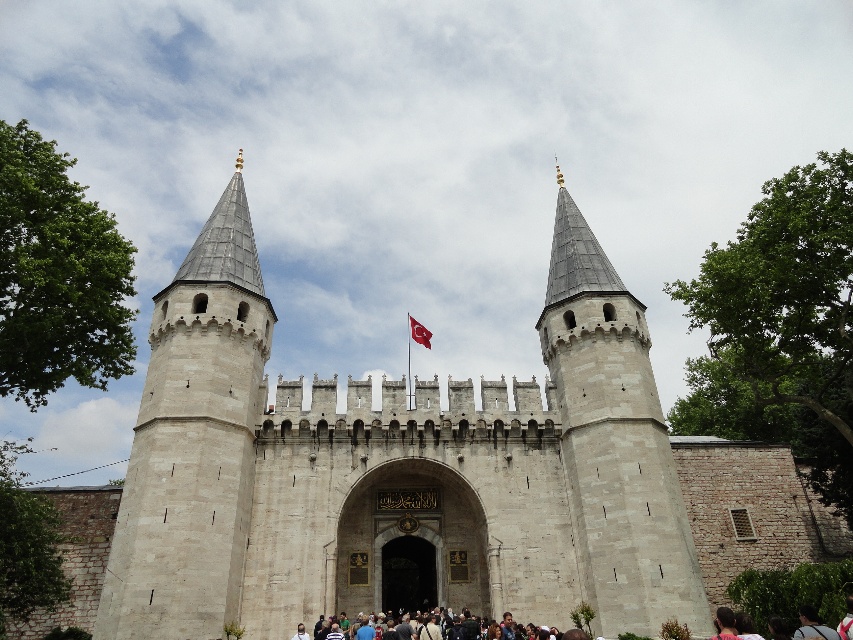
Does point (200, 392) come farther from viewer compared to point (555, 385)?

No.

Does white stone castle at center appear on the right side of light gray stone tower at center?

No, white stone castle at center is not to the right of light gray stone tower at center.

Which is behind, point (351, 436) or point (647, 582)?

The point (351, 436) is more distant.

This screenshot has width=853, height=640. I want to click on white stone castle at center, so click(x=393, y=467).

Does dark stone archway at center lie behind dark brown textured crowd at center?

Yes, dark stone archway at center is behind dark brown textured crowd at center.

Does point (399, 547) come farther from viewer compared to point (579, 604)?

Yes, point (399, 547) is farther from viewer.

This screenshot has height=640, width=853. I want to click on dark stone archway at center, so click(407, 573).

Who is more distant from viewer, (144, 392) or (427, 586)?

The point (427, 586) is more distant.

What do you see at coordinates (393, 467) in the screenshot? I see `white stone castle at center` at bounding box center [393, 467].

Who is more distant from viewer, (465,536) or (421,609)?

Positioned behind is point (465,536).

Where is `white stone castle at center`? The width and height of the screenshot is (853, 640). white stone castle at center is located at coordinates (393, 467).